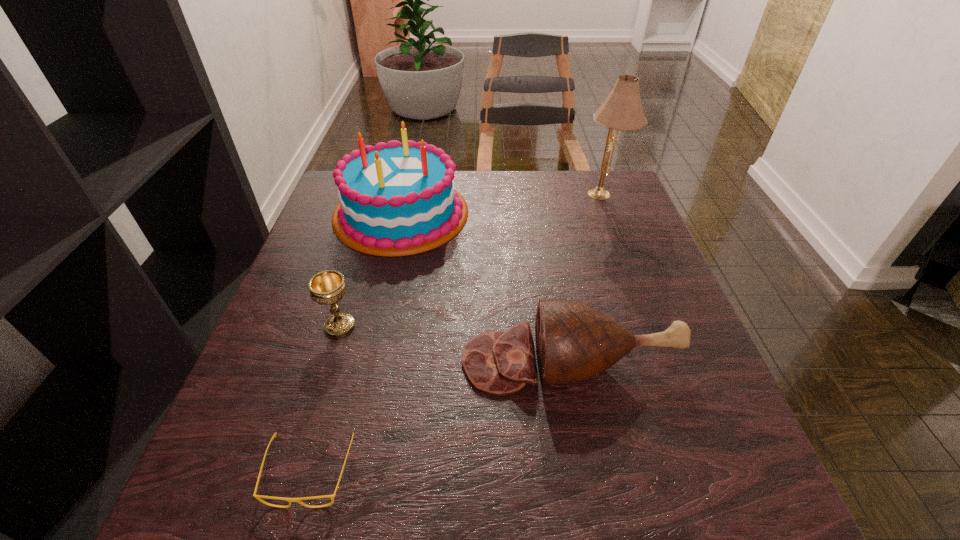
Find the location of a particular element. Image resolution: width=960 pixels, height=540 pixels. the tallest object is located at coordinates coord(622,110).

Locate an element on the screen. Image resolution: width=960 pixels, height=540 pixels. birthday cake is located at coordinates (396, 199).

The height and width of the screenshot is (540, 960). What are the coordinates of `ham` in the screenshot? It's located at (574, 341).

The width and height of the screenshot is (960, 540). I want to click on chalice, so click(328, 287).

You are a GUI agent. You are given a task and a screenshot of the screen. Output one action in this format:
    pyautogui.click(x=<x>, y=<y>)
    Task: Click on the shortest object
    Image resolution: width=960 pixels, height=540 pixels.
    Given the screenshot: What is the action you would take?
    pyautogui.click(x=258, y=497)

You are a GUI agent. You are given a task and a screenshot of the screen. Output one action in this format:
    pyautogui.click(x=<x>, y=<y>)
    Task: Click on the nearest object
    
    Given the screenshot: What is the action you would take?
    pyautogui.click(x=258, y=497)

The height and width of the screenshot is (540, 960). What are the coordinates of `free space located 0.290m on the left of the tallest object` in the screenshot? It's located at (476, 194).

Locate an element on the screen. The width and height of the screenshot is (960, 540). vacant area located 0.350m on the front of the fourth shortest object is located at coordinates (362, 384).

In order to click on vacant position located 0.180m at the sliced end of the ham in this screenshot , I will do `click(365, 361)`.

The image size is (960, 540). In order to click on vacant space located at the sliced end of the ham in this screenshot , I will do `click(337, 361)`.